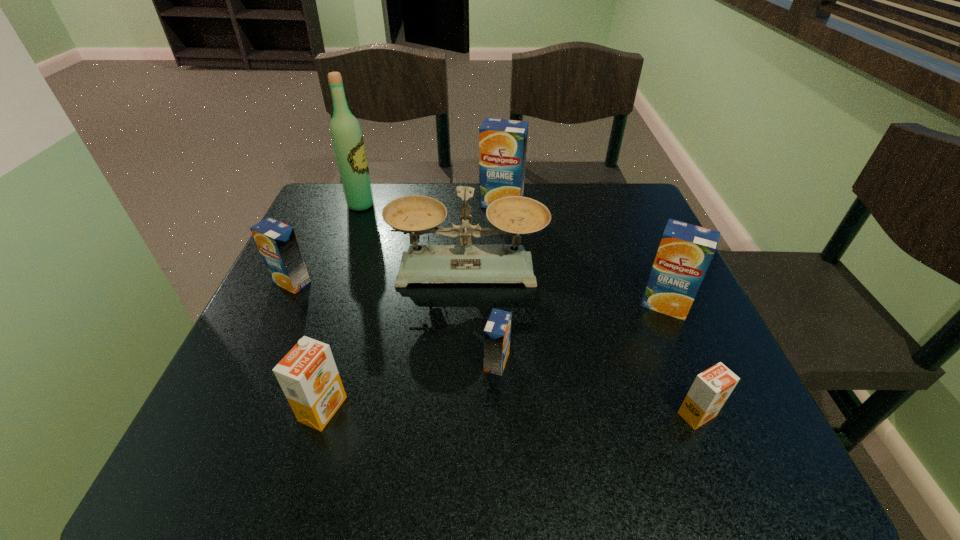
This screenshot has height=540, width=960. I want to click on vacant space located 0.170m on the left of the third nearest orange juice, so click(x=389, y=362).

Identify the location of free spot located 0.060m on the back of the right orange orange juice. (679, 370).

Image resolution: width=960 pixels, height=540 pixels. In order to click on wine bottle that is at the far edge in this screenshot , I will do `click(347, 139)`.

This screenshot has width=960, height=540. I want to click on orange_juice that is at the far edge, so tap(502, 143).

Find the location of a particular element. This screenshot has width=960, height=540. wine bottle located at the left edge is located at coordinates (347, 139).

This screenshot has height=540, width=960. In order to click on object present at the far left corner in this screenshot , I will do `click(347, 139)`.

Locate an element on the screen. The height and width of the screenshot is (540, 960). object that is positioned at the near left corner is located at coordinates (308, 376).

I want to click on object that is at the near right corner, so click(x=711, y=388).

Locate an element on the screen. Image resolution: width=960 pixels, height=540 pixels. vacant space at the far edge is located at coordinates (471, 211).

The image size is (960, 540). In the image, there is a desktop. Identify the location of free space at the near edge. (522, 471).